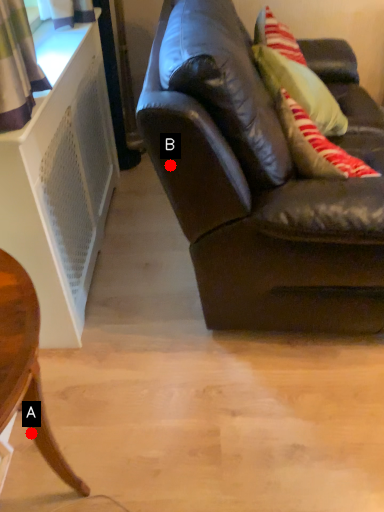
Question: Two points are circled on the image, labeled by A and B beside each circle. Which point is closer to the camera taking this photo?

Choices:
 (A) A is closer
 (B) B is closer

Answer: (A)